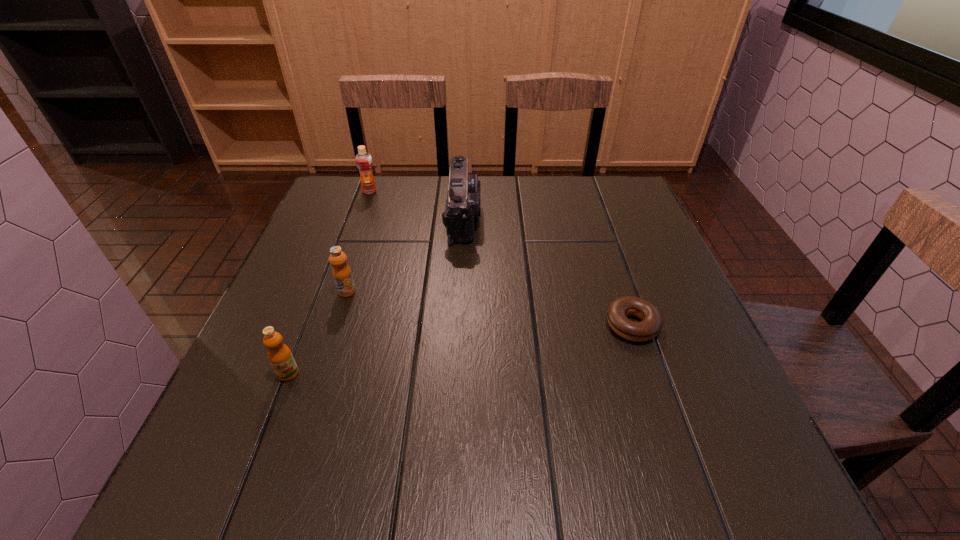
Find the location of a particular element. free space at the far right corner is located at coordinates (594, 199).

What are the coordinates of `unoccupied position between the second object from right to left and the second farthest orange juice` in the screenshot? It's located at (405, 254).

The image size is (960, 540). In order to click on free space that is in between the fourth object from left to right and the second nearest orange juice in this screenshot , I will do `click(405, 254)`.

Find the location of a particular element. vacant area that lies between the doughnut and the farthest orange juice is located at coordinates (500, 258).

Identify the location of unoccupied area between the nearest object and the doughnut. (460, 349).

Where is `free spot between the camcorder and the nearest object`? The image size is (960, 540). free spot between the camcorder and the nearest object is located at coordinates (375, 295).

Find the location of a particular element. This screenshot has width=960, height=540. free space between the farthest orange juice and the camcorder is located at coordinates (417, 204).

Identify the location of free space between the nearest orange juice and the farthest orange juice. The width and height of the screenshot is (960, 540). (329, 282).

I want to click on free space between the nearest object and the camcorder, so click(375, 295).

Image resolution: width=960 pixels, height=540 pixels. In order to click on empty location between the second farthest orange juice and the farthest orange juice in this screenshot , I will do `click(358, 241)`.